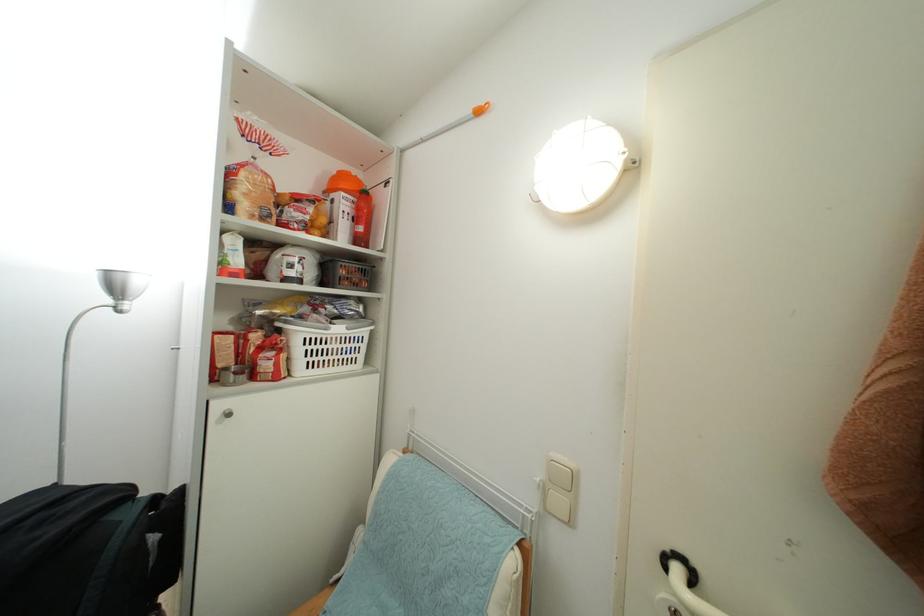
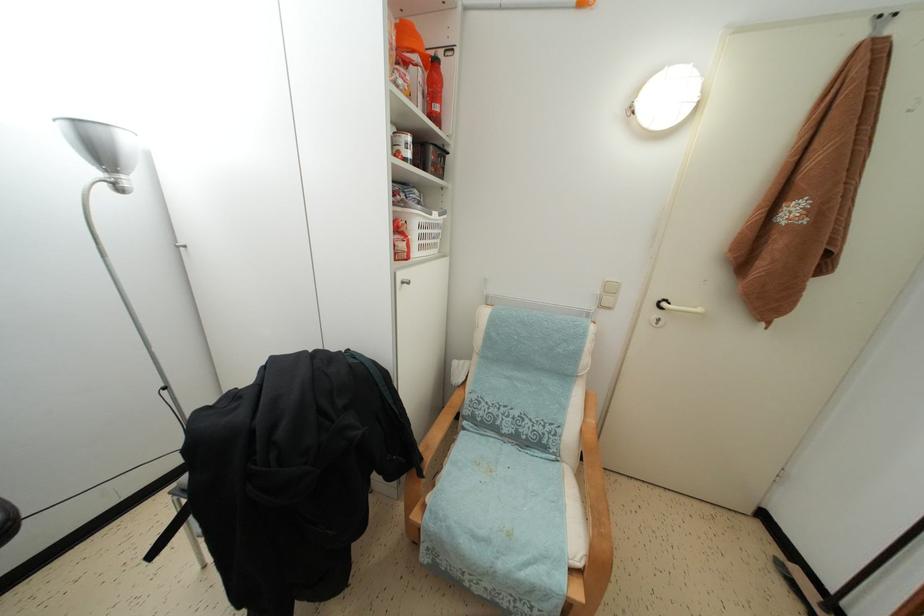
The first image is from the beginning of the video and the second image is from the end. How did the camera likely rotate when shooting the video?

The camera rotated toward right-down.